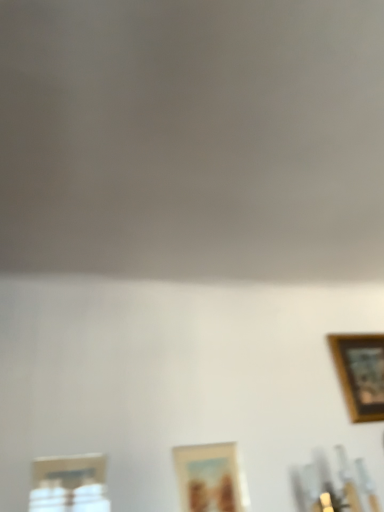
Question: Does metallic silver picture frame at lower left, which ranks as the first picture frame in front-to-back order, have a lesser width compared to wooden picture frame at lower center, which ranks as the second picture frame in right-to-left order?

Choices:
 (A) yes
 (B) no

Answer: (B)

Question: Is metallic silver picture frame at lower left, placed as the 1th picture frame when sorted from left to right, behind wooden picture frame at lower center, which is the second picture frame from back to front?

Choices:
 (A) yes
 (B) no

Answer: (B)

Question: Considering the relative positions of metallic silver picture frame at lower left, the 3th picture frame when ordered from back to front, and wooden picture frame at lower center, which is the second picture frame from back to front, in the image provided, is metallic silver picture frame at lower left, the 3th picture frame when ordered from back to front, to the right of wooden picture frame at lower center, which is the second picture frame from back to front, from the viewer's perspective?

Choices:
 (A) no
 (B) yes

Answer: (A)

Question: Does metallic silver picture frame at lower left, placed as the 1th picture frame when sorted from left to right, have a smaller size compared to wooden picture frame at lower center, positioned as the 2th picture frame in front-to-back order?

Choices:
 (A) no
 (B) yes

Answer: (A)

Question: Is metallic silver picture frame at lower left, placed as the 1th picture frame when sorted from left to right, closer to camera compared to wooden picture frame at lower center, positioned as the 2th picture frame in front-to-back order?

Choices:
 (A) no
 (B) yes

Answer: (B)

Question: Would you say wooden framed picture at upper right, which is the first picture frame in right-to-left order, is to the left or to the right of metallic silver picture frame at lower left, the 3th picture frame when ordered from back to front, in the picture?

Choices:
 (A) left
 (B) right

Answer: (B)

Question: Is wooden framed picture at upper right, marked as the 3th picture frame in a left-to-right arrangement, spatially inside metallic silver picture frame at lower left, the 3th picture frame when ordered from back to front, or outside of it?

Choices:
 (A) inside
 (B) outside

Answer: (B)

Question: From a real-world perspective, is wooden framed picture at upper right, which appears as the first picture frame when viewed from the back, physically located above or below metallic silver picture frame at lower left, which is the third picture frame from right to left?

Choices:
 (A) above
 (B) below

Answer: (A)

Question: Is point (360, 346) closer or farther from the camera than point (44, 479)?

Choices:
 (A) closer
 (B) farther

Answer: (B)

Question: From a real-world perspective, relative to wooden picture frame at lower center, the 2th picture frame when ordered from left to right, is wooden framed picture at upper right, which is the first picture frame in right-to-left order, vertically above or below?

Choices:
 (A) below
 (B) above

Answer: (B)

Question: Do you think wooden framed picture at upper right, which is the first picture frame in right-to-left order, is within wooden picture frame at lower center, the 2th picture frame when ordered from left to right, or outside of it?

Choices:
 (A) inside
 (B) outside

Answer: (B)

Question: In the image, is wooden framed picture at upper right, marked as the 3th picture frame in a left-to-right arrangement, on the left side or the right side of wooden picture frame at lower center, which ranks as the second picture frame in right-to-left order?

Choices:
 (A) right
 (B) left

Answer: (A)

Question: From the image's perspective, is wooden framed picture at upper right, which is the first picture frame in right-to-left order, positioned above or below wooden picture frame at lower center, which is the second picture frame from back to front?

Choices:
 (A) below
 (B) above

Answer: (B)

Question: Based on their sizes in the image, would you say wooden picture frame at lower center, positioned as the 2th picture frame in front-to-back order, is bigger or smaller than metallic silver picture frame at lower left, the 3th picture frame when ordered from back to front?

Choices:
 (A) small
 (B) big

Answer: (A)

Question: Considering the positions of point (228, 500) and point (61, 473), is point (228, 500) closer or farther from the camera than point (61, 473)?

Choices:
 (A) farther
 (B) closer

Answer: (A)